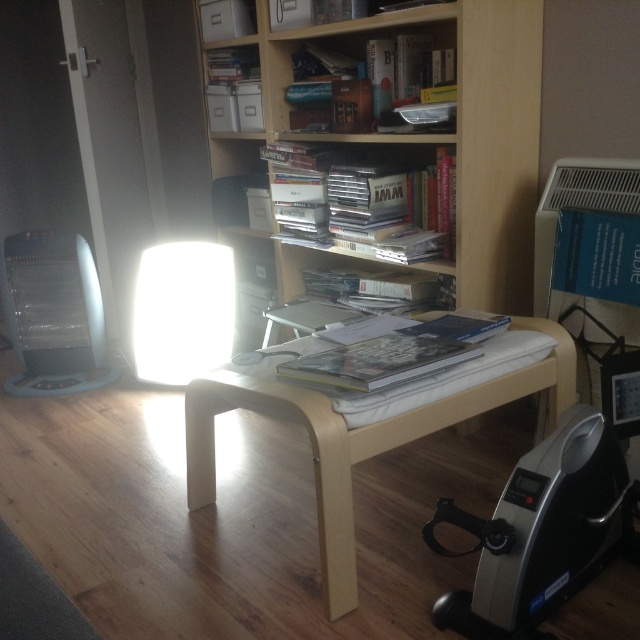
Which is behind, point (497, 173) or point (422, 204)?

Positioned behind is point (422, 204).

Can you confirm if wooden bookshelf at upper center is positioned to the left of white matte book at center?

Correct, you'll find wooden bookshelf at upper center to the left of white matte book at center.

This screenshot has height=640, width=640. What do you see at coordinates (403, 141) in the screenshot? I see `wooden bookshelf at upper center` at bounding box center [403, 141].

Locate an element on the screen. The image size is (640, 640). wooden bookshelf at upper center is located at coordinates (403, 141).

Can you confirm if light wood table at center is wider than white glossy lampshade at center?

Yes.

The image size is (640, 640). Find the location of `light wood table at center`. light wood table at center is located at coordinates (371, 426).

The width and height of the screenshot is (640, 640). Find the location of `light wood table at center`. light wood table at center is located at coordinates (371, 426).

Find the location of a particular element. white matte book at center is located at coordinates point(369,198).

Is white matte book at center positioned behind hardcover book at upper center?

Yes, white matte book at center is further from the viewer.

Does point (339, 154) come behind point (356, 116)?

Yes, point (339, 154) is behind point (356, 116).

Find the location of a particular element. The width and height of the screenshot is (640, 640). white matte book at center is located at coordinates (369, 198).